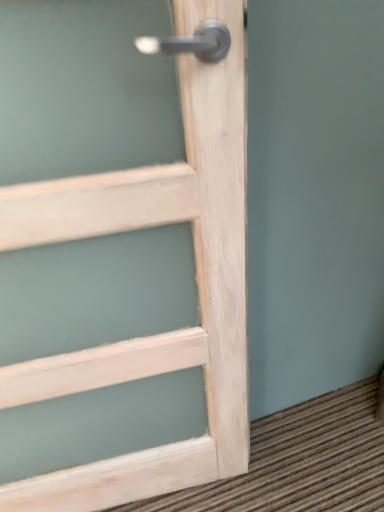
You are a GUI agent. You are given a task and a screenshot of the screen. Output one action in this format:
    pyautogui.click(x=<x>, y=<y>)
    Task: Click on the vacant space to the right of natural wood door at center
    
    Given the screenshot: What is the action you would take?
    pyautogui.click(x=304, y=456)